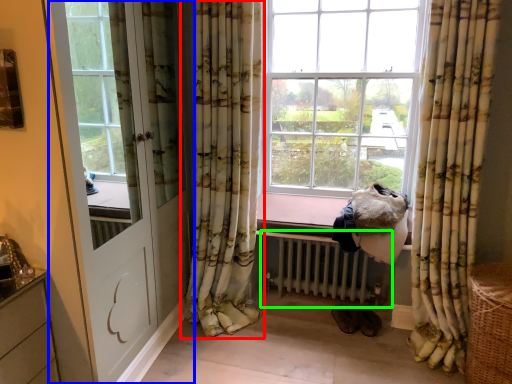
Question: Which object is the farthest from curtain (highlighted by a red box)? Choose among these: door (highlighted by a blue box) or radiator (highlighted by a green box).

Choices:
 (A) door
 (B) radiator

Answer: (B)